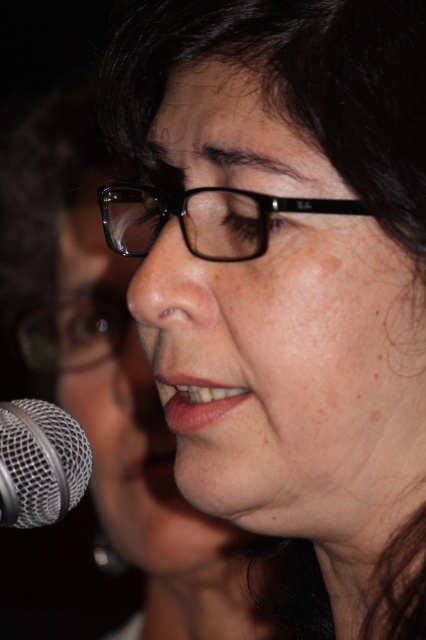
Does point (66, 468) come behind point (57, 348)?

No.

Where is `silver mesh microphone at lower left`? silver mesh microphone at lower left is located at coordinates (40, 461).

Which of these two, black plastic glasses at center or black plastic glasses at upper left, stands shorter?

With less height is black plastic glasses at center.

Is black plastic glasses at center shorter than black plastic glasses at upper left?

Correct, black plastic glasses at center is not as tall as black plastic glasses at upper left.

What do you see at coordinates (203, 218) in the screenshot?
I see `black plastic glasses at center` at bounding box center [203, 218].

Locate an element on the screen. black plastic glasses at center is located at coordinates (203, 218).

Does black plastic glasses at center have a greater width compared to silver mesh microphone at lower left?

Yes, black plastic glasses at center is wider than silver mesh microphone at lower left.

Who is taller, black plastic glasses at center or silver mesh microphone at lower left?

Standing taller between the two is silver mesh microphone at lower left.

Describe the element at coordinates (203, 218) in the screenshot. I see `black plastic glasses at center` at that location.

Identify the location of black plastic glasses at center. The height and width of the screenshot is (640, 426). (203, 218).